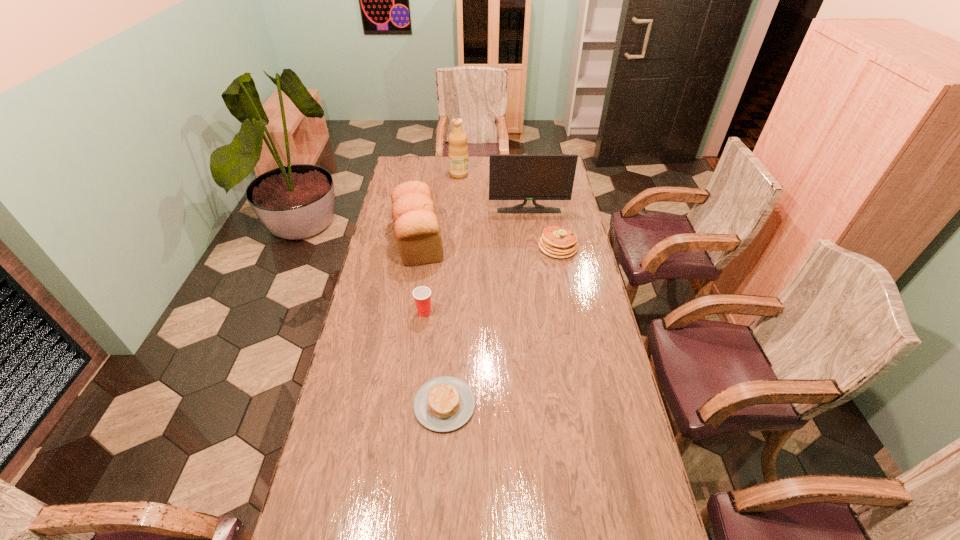
I want to click on the second closest pancake to the fifth nearest object, so click(x=443, y=404).

At what (x,y) coordinates should I click in order to perform the action: click on vacant area that satisfies the following two spatial constraints: 1. on the front-facing side of the farther pancake; 2. on the left side of the monitor. Please return your answer as a coordinate pair (x, y). Looking at the image, I should click on (534, 247).

You are a GUI agent. You are given a task and a screenshot of the screen. Output one action in this format:
    pyautogui.click(x=<x>, y=<y>)
    Task: Click on the free space that satisfies the following two spatial constraints: 1. on the front-facing side of the monitor; 2. on the left side of the taller pancake
    This screenshot has width=960, height=540.
    Given the screenshot: What is the action you would take?
    pyautogui.click(x=534, y=247)

The image size is (960, 540). Identify the location of vacant space that satisfies the following two spatial constraints: 1. on the label of the farthest object; 2. on the front side of the fourth tallest object. (450, 312).

Locate an element on the screen. The image size is (960, 540). free space that satisfies the following two spatial constraints: 1. on the back side of the taller pancake; 2. on the label of the olive oil is located at coordinates (543, 174).